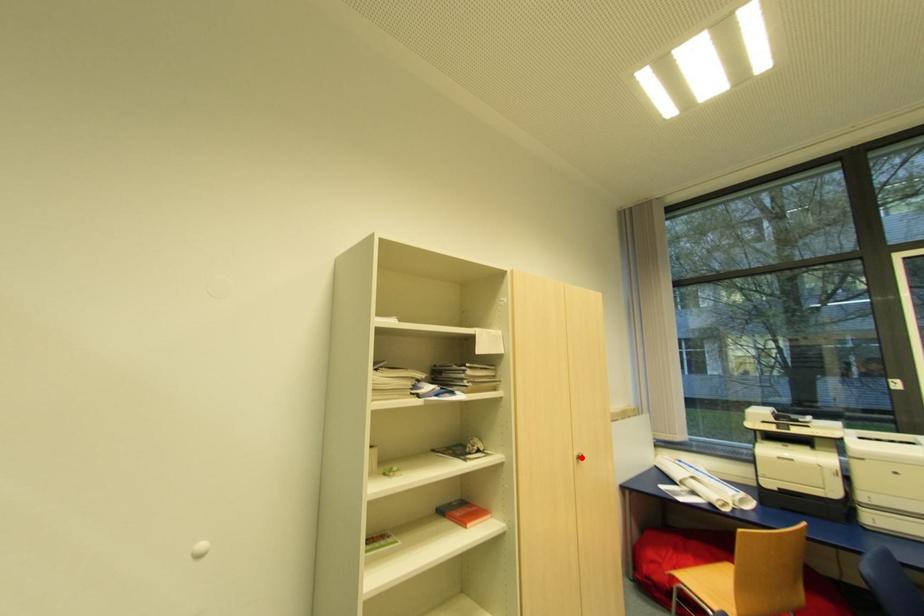
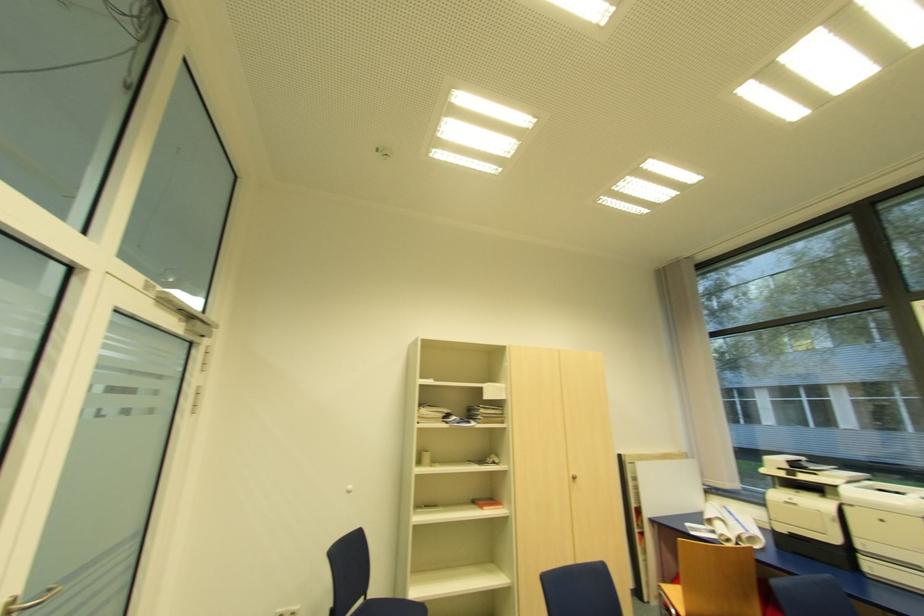
In the second image, find the point that corresponds to the highlighted location in the first image.

(576, 477)